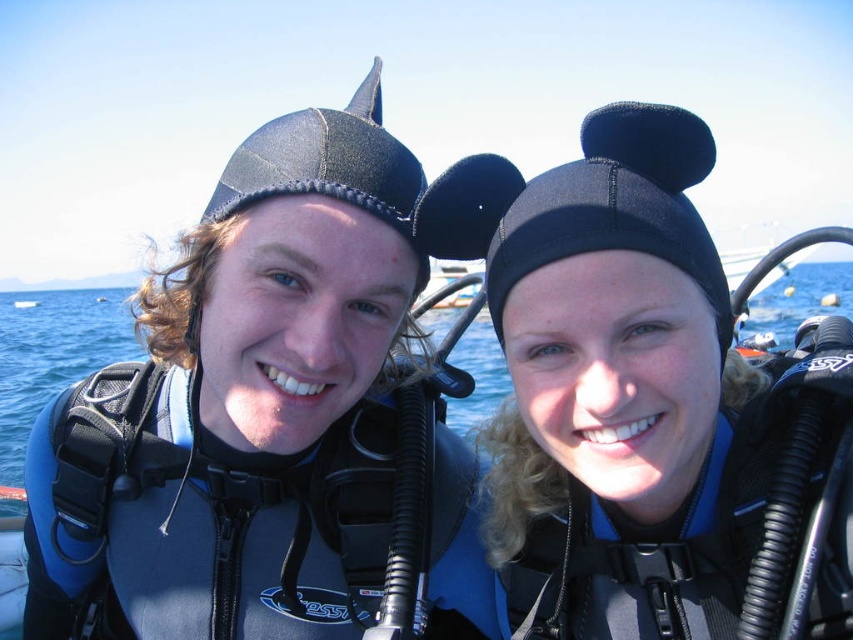
Can you confirm if black neoprene swim cap at center is taller than blue matte water at center?

In fact, black neoprene swim cap at center may be shorter than blue matte water at center.

Identify the location of black neoprene swim cap at center. The image size is (853, 640). (656, 413).